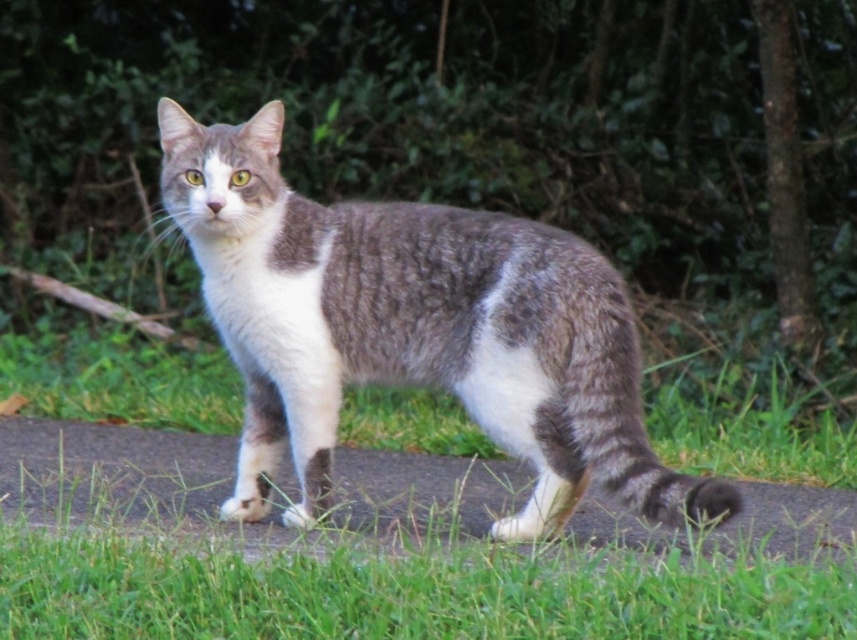
Question: Is gray asphalt at center below gray striped tail at lower right?

Choices:
 (A) no
 (B) yes

Answer: (B)

Question: Does gray tabby cat at center have a greater width compared to gray asphalt at center?

Choices:
 (A) no
 (B) yes

Answer: (A)

Question: Can you confirm if gray tabby cat at center is positioned above gray striped tail at lower right?

Choices:
 (A) yes
 (B) no

Answer: (A)

Question: Which object is the closest to the gray tabby cat at center?

Choices:
 (A) gray asphalt at center
 (B) gray striped tail at lower right

Answer: (B)

Question: Which point appears farthest from the camera in this image?

Choices:
 (A) (345, 516)
 (B) (546, 328)
 (C) (602, 456)

Answer: (A)

Question: Which point is closer to the camera taking this photo?

Choices:
 (A) (256, 115)
 (B) (595, 378)
 (C) (750, 532)

Answer: (B)